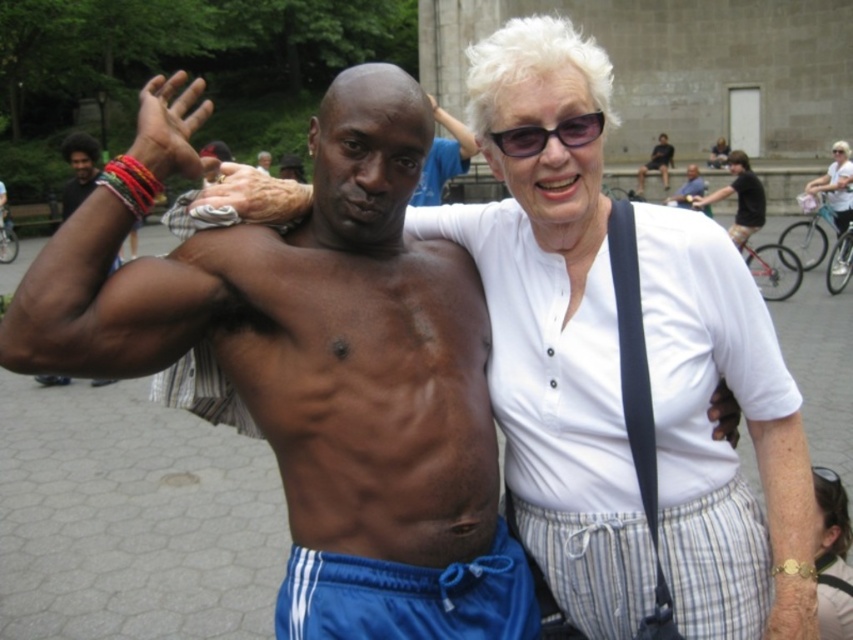
Question: Which object appears farthest from the camera in this image?

Choices:
 (A) smooth skin torso at center
 (B) blue fabric shorts at lower center
 (C) dark brown skin at center
 (D) black plastic sunglasses at upper center

Answer: (C)

Question: Which of the following is the farthest from the observer?

Choices:
 (A) smooth skin torso at center
 (B) black plastic sunglasses at upper center
 (C) dark brown skin at center
 (D) blue fabric shorts at lower center

Answer: (C)

Question: Can you confirm if dark brown skin at center is bigger than black plastic sunglasses at upper center?

Choices:
 (A) yes
 (B) no

Answer: (A)

Question: Can you confirm if blue fabric shorts at lower center is positioned to the right of smooth skin torso at center?

Choices:
 (A) yes
 (B) no

Answer: (B)

Question: Which point is closer to the camera taking this photo?

Choices:
 (A) (439, 148)
 (B) (730, 168)
 (C) (601, 124)

Answer: (C)

Question: Does smooth skin torso at center have a smaller size compared to black plastic sunglasses at upper center?

Choices:
 (A) no
 (B) yes

Answer: (A)